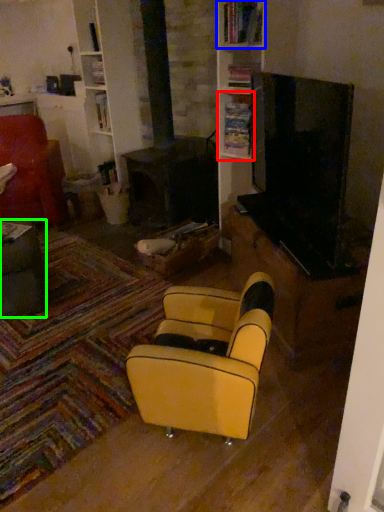
Question: Which object is positioned farthest from shelf (highlighted by a red box)? Select from shelf (highlighted by a blue box) and table (highlighted by a green box).

Choices:
 (A) shelf
 (B) table

Answer: (B)